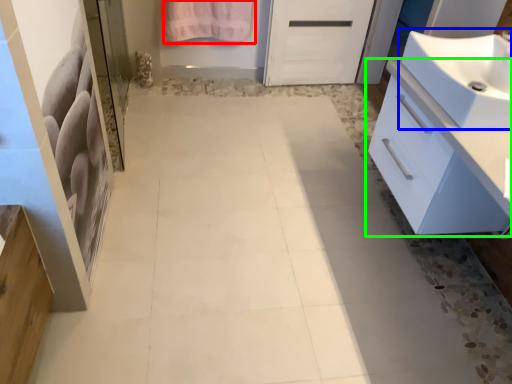
Question: Which object is positioned farthest from bath towel (highlighted by a red box)? Select from sink (highlighted by a blue box) and bathroom cabinet (highlighted by a green box).

Choices:
 (A) sink
 (B) bathroom cabinet

Answer: (B)